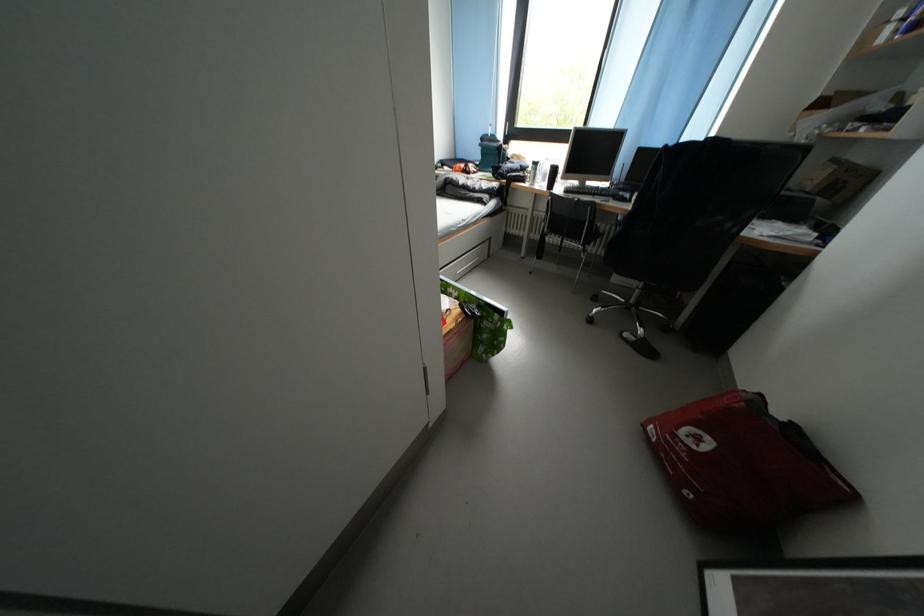
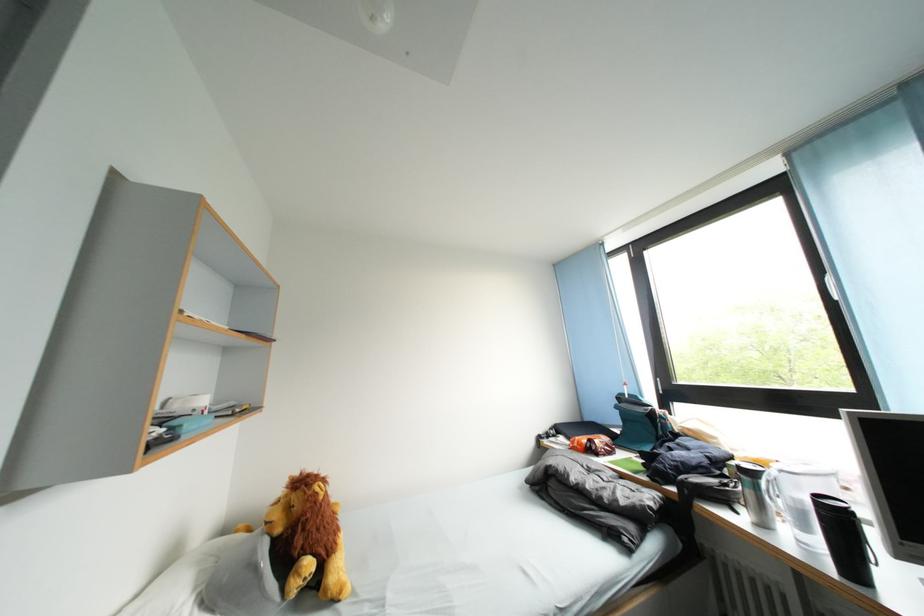
Locate, in the second image, the point that corresponds to point (549, 190) in the first image.

(808, 546)